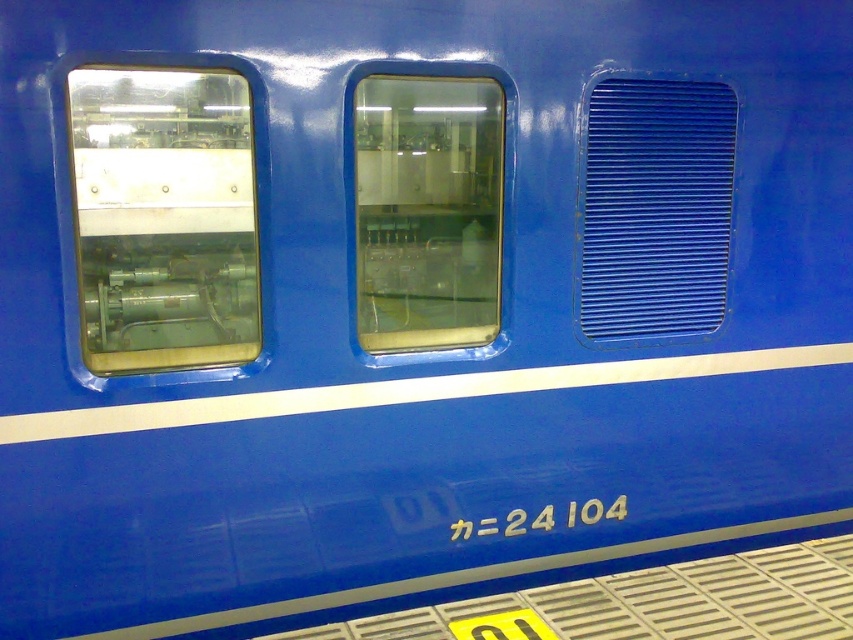
Question: Is transparent glass window at center below blue textured vent at right?

Choices:
 (A) no
 (B) yes

Answer: (B)

Question: From the image, what is the correct spatial relationship of transparent glass window at left in relation to blue textured vent at right?

Choices:
 (A) below
 (B) above

Answer: (A)

Question: Which point is farther to the camera?

Choices:
 (A) transparent glass window at left
 (B) transparent glass window at center
 (C) blue textured vent at right

Answer: (C)

Question: Estimate the real-world distances between objects in this image. Which object is farther from the blue textured vent at right?

Choices:
 (A) transparent glass window at center
 (B) transparent glass window at left

Answer: (B)

Question: Which object appears closest to the camera in this image?

Choices:
 (A) transparent glass window at center
 (B) transparent glass window at left
 (C) blue textured vent at right

Answer: (B)

Question: Can you confirm if transparent glass window at center is wider than blue textured vent at right?

Choices:
 (A) no
 (B) yes

Answer: (A)